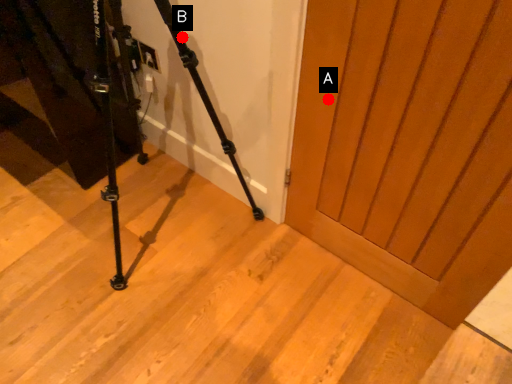
Question: Two points are circled on the image, labeled by A and B beside each circle. Which of the following is the farthest from the observer?

Choices:
 (A) A is further
 (B) B is further

Answer: (B)